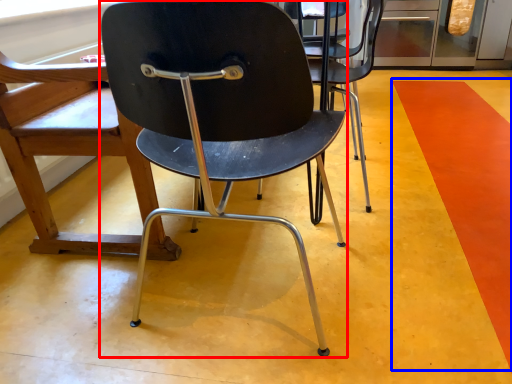
Question: Among these objects, which one is farthest to the camera, chair (highlighted by a red box) or strip (highlighted by a blue box)?

Choices:
 (A) chair
 (B) strip

Answer: (B)